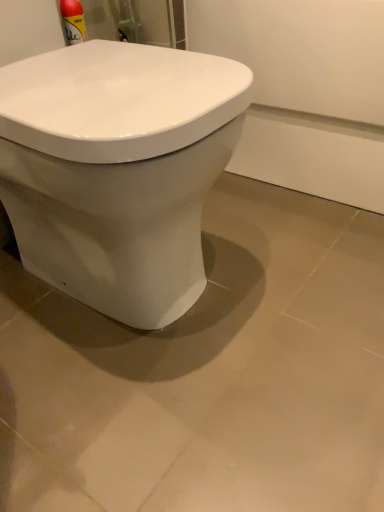
Find the location of `white glossy toilet at center`. white glossy toilet at center is located at coordinates (117, 170).

Describe the element at coordinates (117, 170) in the screenshot. This screenshot has width=384, height=512. I see `white glossy toilet at center` at that location.

What do you see at coordinates (208, 374) in the screenshot? Image resolution: width=384 pixels, height=512 pixels. I see `matte white ceramic tile at center` at bounding box center [208, 374].

You are a GUI agent. You are given a task and a screenshot of the screen. Output one action in this format:
    pyautogui.click(x=<x>, y=<y>)
    Task: Click on the matte white ceramic tile at center
    
    Given the screenshot: What is the action you would take?
    [x=208, y=374]

Locate an element on the screen. The height and width of the screenshot is (512, 384). white glossy toilet at center is located at coordinates (117, 170).

Considering the relative positions of matte white ceramic tile at center and white glossy toilet at center in the image provided, is matte white ceramic tile at center to the left of white glossy toilet at center from the viewer's perspective?

Incorrect, matte white ceramic tile at center is not on the left side of white glossy toilet at center.

Based on the photo, is matte white ceramic tile at center positioned before white glossy toilet at center?

No, matte white ceramic tile at center is further to the viewer.

Considering the positions of point (304, 498) and point (99, 308), is point (304, 498) closer or farther from the camera than point (99, 308)?

Point (304, 498) is positioned closer to the camera compared to point (99, 308).

From the image's perspective, is matte white ceramic tile at center located above or below white glossy toilet at center?

Clearly, from the image's perspective, matte white ceramic tile at center is below white glossy toilet at center.

Consider the image. From a real-world perspective, between matte white ceramic tile at center and white glossy toilet at center, who is vertically lower?

matte white ceramic tile at center, from a real-world perspective.

Between matte white ceramic tile at center and white glossy toilet at center, which one has larger width?

matte white ceramic tile at center.

Is matte white ceramic tile at center taller than white glossy toilet at center?

Incorrect, the height of matte white ceramic tile at center is not larger of that of white glossy toilet at center.

Does matte white ceramic tile at center have a smaller size compared to white glossy toilet at center?

Correct, matte white ceramic tile at center occupies less space than white glossy toilet at center.

Is matte white ceramic tile at center positioned beyond the bounds of white glossy toilet at center?

Absolutely, matte white ceramic tile at center is external to white glossy toilet at center.

Is matte white ceramic tile at center next to white glossy toilet at center?

There is a gap between matte white ceramic tile at center and white glossy toilet at center.

Does matte white ceramic tile at center turn towards white glossy toilet at center?

Yes, matte white ceramic tile at center faces towards white glossy toilet at center.

The height and width of the screenshot is (512, 384). Identify the location of toilet above the matte white ceramic tile at center (from the image's perspective). (117, 170).

Considering the relative positions of white glossy toilet at center and matte white ceramic tile at center in the image provided, is white glossy toilet at center to the right of matte white ceramic tile at center from the viewer's perspective?

No.

Relative to matte white ceramic tile at center, is white glossy toilet at center in front or behind?

white glossy toilet at center is positioned closer to the viewer than matte white ceramic tile at center.

Is point (43, 199) closer or farther from the camera than point (266, 197)?

Point (43, 199).

Looking at this image, from the image's perspective, relative to matte white ceramic tile at center, is white glossy toilet at center above or below?

white glossy toilet at center is situated higher than matte white ceramic tile at center in the image.

Based on the photo, from a real-world perspective, is white glossy toilet at center positioned over matte white ceramic tile at center based on gravity?

Yes.

Considering the sizes of objects white glossy toilet at center and matte white ceramic tile at center in the image provided, who is wider, white glossy toilet at center or matte white ceramic tile at center?

matte white ceramic tile at center.

Can you confirm if white glossy toilet at center is taller than matte white ceramic tile at center?

Indeed, white glossy toilet at center has a greater height compared to matte white ceramic tile at center.

Consider the image. Between white glossy toilet at center and matte white ceramic tile at center, which one has larger size?

Bigger between the two is white glossy toilet at center.

Does white glossy toilet at center contain matte white ceramic tile at center?

That's incorrect, matte white ceramic tile at center is not inside white glossy toilet at center.

Based on the photo, would you say white glossy toilet at center is a long distance from matte white ceramic tile at center?

No.

Does white glossy toilet at center turn towards matte white ceramic tile at center?

No, white glossy toilet at center is not aimed at matte white ceramic tile at center.

How different are the orientations of white glossy toilet at center and matte white ceramic tile at center in degrees?

The facing directions of white glossy toilet at center and matte white ceramic tile at center are 90 degrees apart.

Measure the distance between white glossy toilet at center and matte white ceramic tile at center.

white glossy toilet at center is 10.62 inches away from matte white ceramic tile at center.

Where is `toilet above the matte white ceramic tile at center (from a real-world perspective)`? The image size is (384, 512). toilet above the matte white ceramic tile at center (from a real-world perspective) is located at coordinates (117, 170).

The image size is (384, 512). What are the coordinates of `toilet that is above the matte white ceramic tile at center (from the image's perspective)` in the screenshot? It's located at (117, 170).

This screenshot has width=384, height=512. In order to click on toilet above the matte white ceramic tile at center (from a real-world perspective) in this screenshot , I will do `click(117, 170)`.